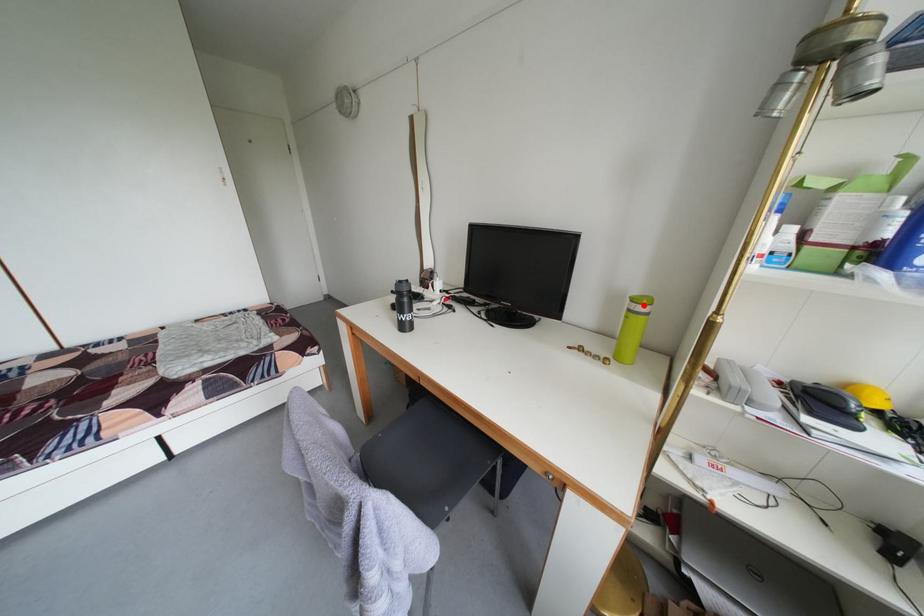
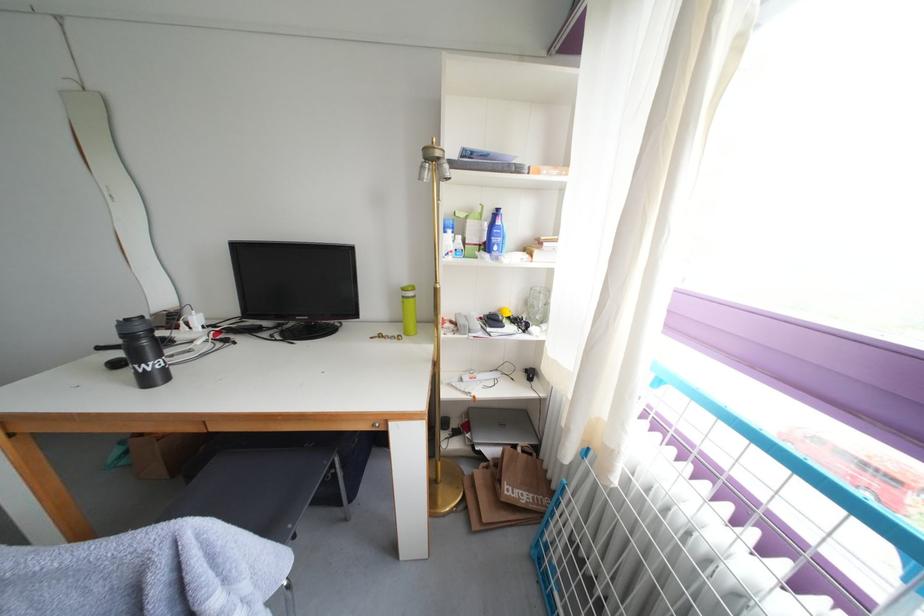
Where in the second image is the point corresponding to the highlighted location from the first image?

(414, 294)